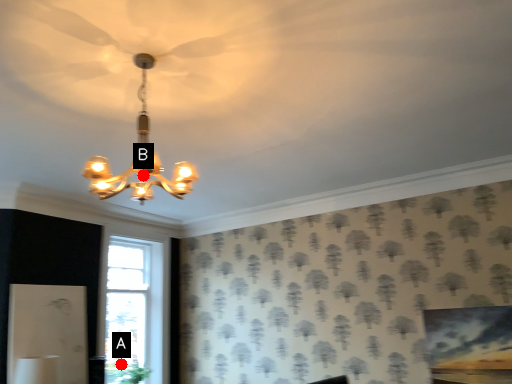
Question: Two points are circled on the image, labeled by A and B beside each circle. Which point is further to the camera?

Choices:
 (A) A is further
 (B) B is further

Answer: (A)